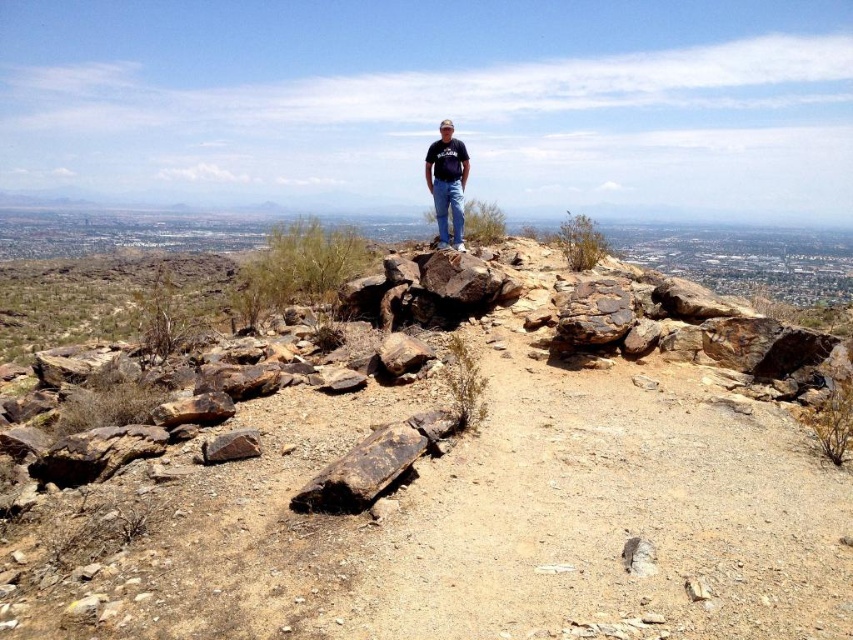
You are a hiker who wants to know if the brown rocky hillside at center is wider than the black cotton shirt at center. Can you determine this based on the scene?

The brown rocky hillside at center is narrower than the black cotton shirt at center, so the black cotton shirt at center is wider.

You are a hiker who wants to take a photo of the cityscape in the background. To do this, you need to move from your current position near the brown rough rock at lower left to a spot where you can see the city clearly. Which direction should you move relative to the black cotton shirt at center?

The black cotton shirt at center is positioned on the right side of brown rough rock at lower left. To get a clear view of the cityscape in the background, you should move to the left side of the black cotton shirt at center, away from the brown rough rock at lower left.